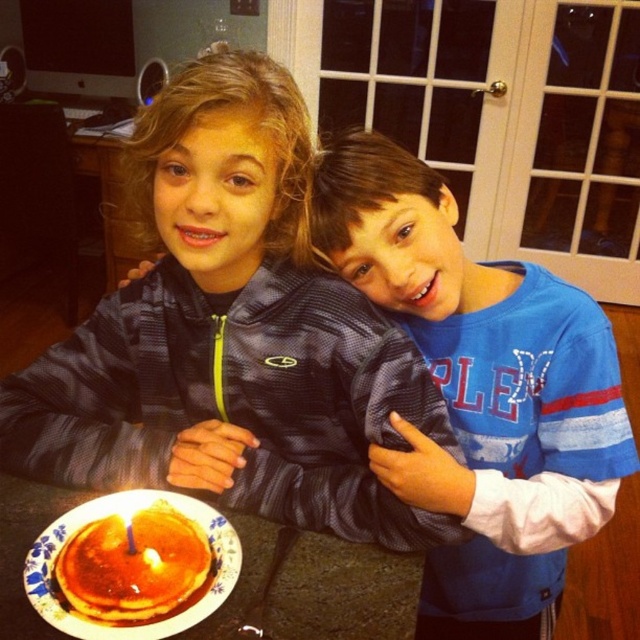
You are taking a photo of the two children sitting at the table. Which of the two points, point 1 at coordinates (556, 572) or point 2 at coordinates (125, 532), would appear closer to you in the photo?

Point 1 at coordinates (556, 572) is further to the camera than point 2 at coordinates (125, 532), so point 1 would appear closer to you in the photo.

You are a photographer taking a picture of the two children and their dessert. You want to ensure the white paper plate at lower left and the golden syrup pancake at lower left are both clearly visible in the frame. Which object should you focus on first to make sure both are in focus?

The white paper plate at lower left is in front of the golden syrup pancake at lower left, so you should focus on the white paper plate at lower left first to ensure both are in focus.

You are a photographer trying to capture a closeup of the yellow wax candle at lower left without the golden syrup pancake at lower left blocking the view. Can you adjust your position to do this?

The golden syrup pancake at lower left is closer to the viewer than the yellow wax candle at lower left, so moving your camera position slightly to the side or tilting it might allow you to avoid the pancake and focus on the candle.